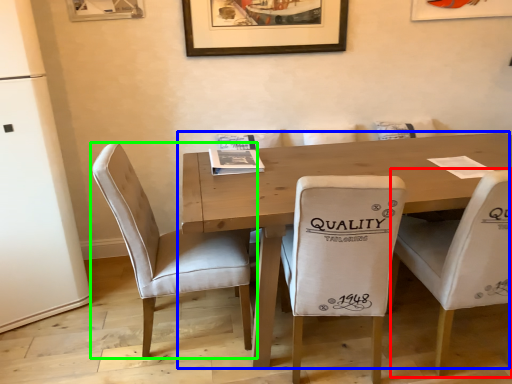
Question: Which object is the farthest from chair (highlighted by a red box)? Choose among these: table (highlighted by a blue box) or chair (highlighted by a green box).

Choices:
 (A) table
 (B) chair

Answer: (B)